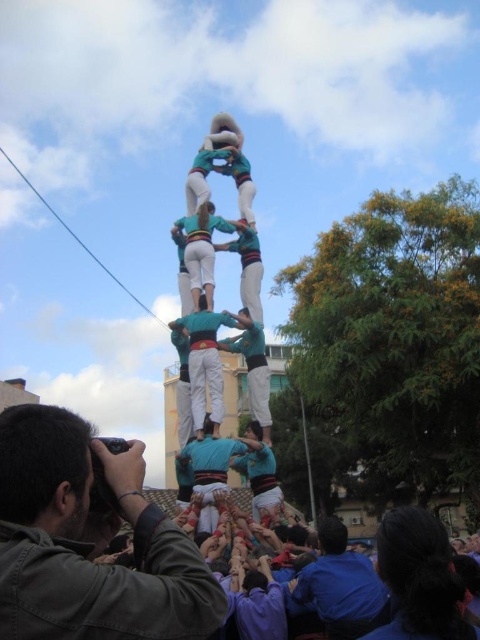
You are a photographer standing in front of the human tower scene. You notice two figures in blue clothing, the blue cotton shirt at lower right and the blue fabric human at center. Which figure appears narrower in width?

The blue cotton shirt at lower right is thinner than the blue fabric human at center, so the blue cotton shirt at lower right appears narrower in width.

You are a photographer trying to capture the human tower. You have a dark green fabric camera at lower left and a blue cotton shirt at lower right in your frame. Which object is wider?

The dark green fabric camera at lower left is wider than the blue cotton shirt at lower right.

You are a photographer standing at the base of the human tower and want to capture a photo of both the blue cotton shirt at lower right and the blue fabric human at center in the same frame. Given that your camera has a maximum zoom range of 30 feet, will you be able to include both subjects in the photo without moving closer?

The blue cotton shirt at lower right and blue fabric human at center are 38.09 feet apart from each other. Since the camera can only zoom up to 30 feet, the distance between them exceeds the maximum zoom range. Therefore, you won cannot capture both subjects in the same frame without moving closer.